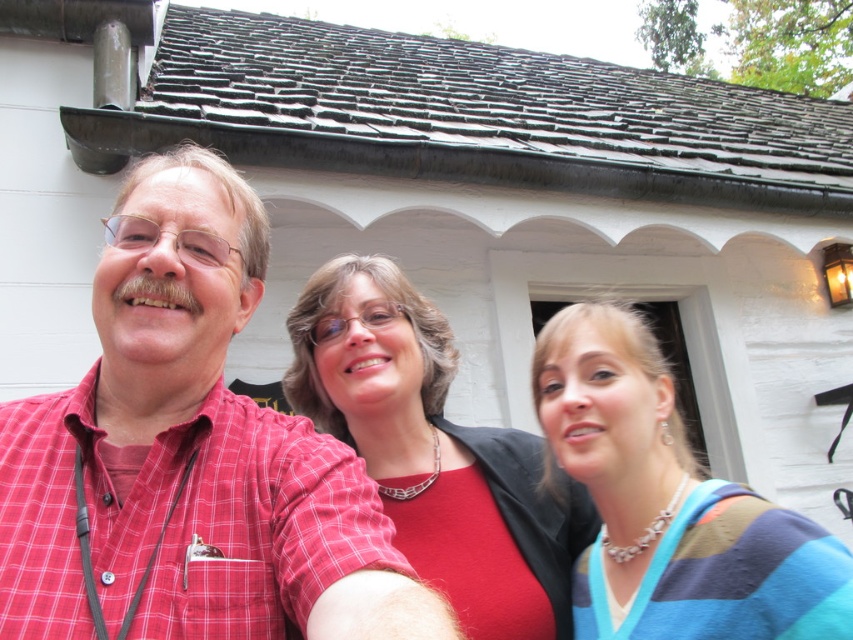
You are a photographer trying to capture a group photo of the red checkered shirt at center and the matte red blouse at center. Which person should you position closer to the camera to ensure their tops are framed similarly?

The red checkered shirt at center is shorter than the matte red blouse at center, so you should position the person wearing the red checkered shirt at center closer to the camera to compensate for its shorter length and ensure both tops are framed similarly.

Based on the photo, you are standing in front of the white building with the open door. There are two points marked in the image. The first point is at coordinates point [247,250] and the second is at point [587,317]. Which of these two points is closer to you?

Point [247,250] is closer to the viewer than point [587,317].